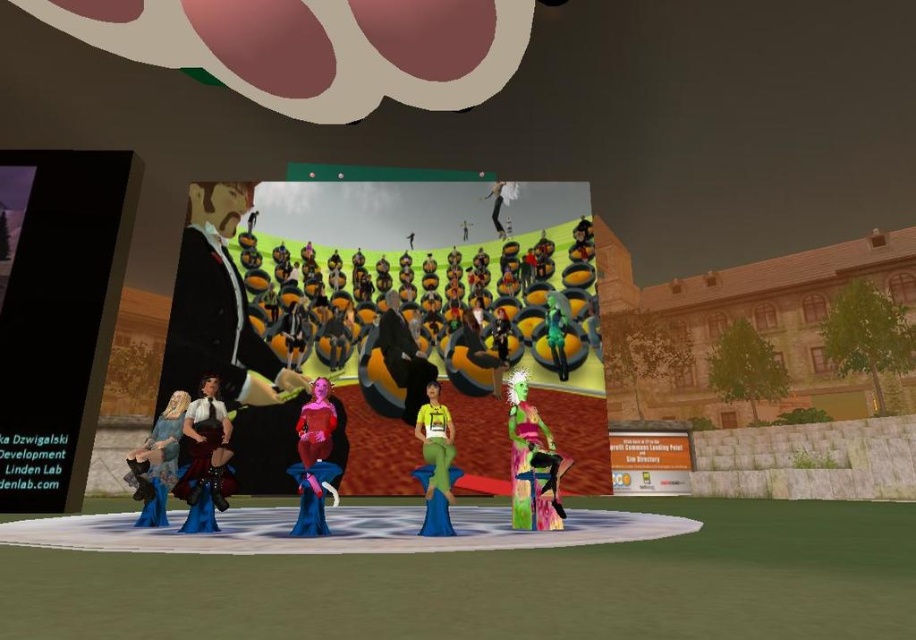
You are an avatar in the virtual environment and you want to find the exact location of the point marked as point [402,356]. Which object is this point located on?

The point [402,356] is located on the matte black suit at center.

You are an avatar attending a virtual event and want to greet both the shiny black dress at center and the green matte figure at center. If you can only approach one of them without moving more than 3 meters from your current position, which one can you reach?

Both the shiny black dress at center and the green matte figure at center are 2.96 meters apart, so you can reach either one without exceeding the 3 meter limit.